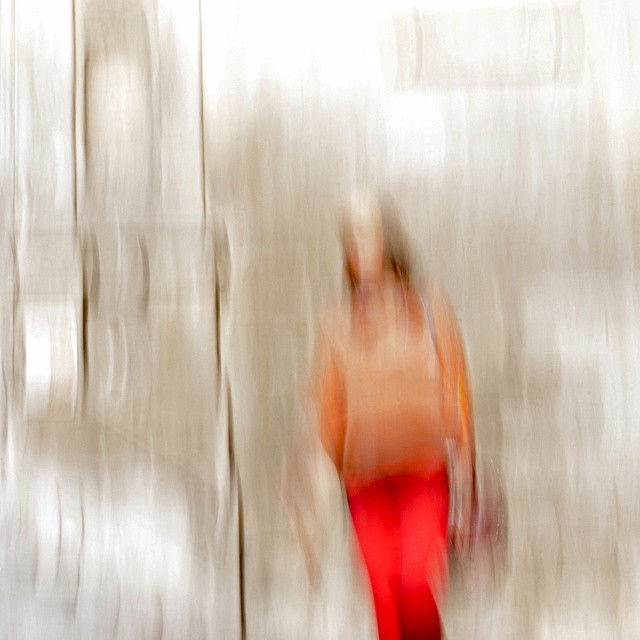
Can you confirm if smooth orange fabric at center is positioned to the right of matte red leggings at center?

Incorrect, smooth orange fabric at center is not on the right side of matte red leggings at center.

Does smooth orange fabric at center have a larger size compared to matte red leggings at center?

Correct, smooth orange fabric at center is larger in size than matte red leggings at center.

Where is `smooth orange fabric at center`? The image size is (640, 640). smooth orange fabric at center is located at coordinates (396, 422).